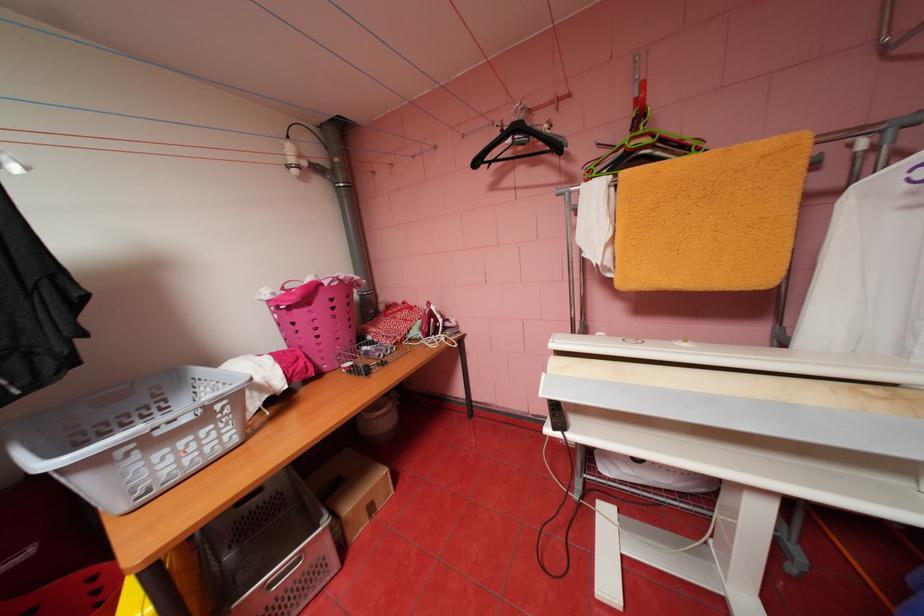
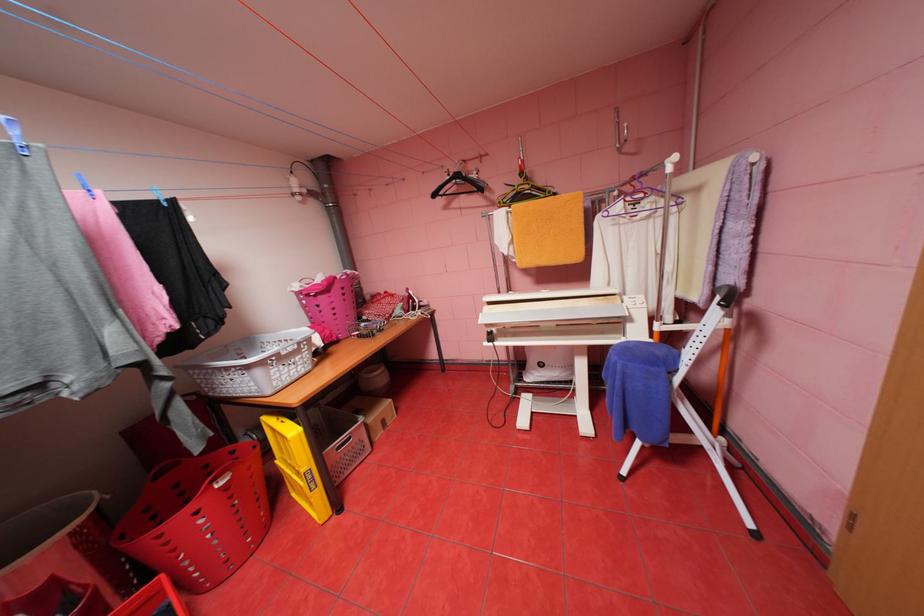
Question: The camera is either moving clockwise (left) or counter-clockwise (right) around the object. The first image is from the beginning of the video and the second image is from the end. Is the camera moving left or right when shooting the video?

Choices:
 (A) Left
 (B) Right

Answer: (A)